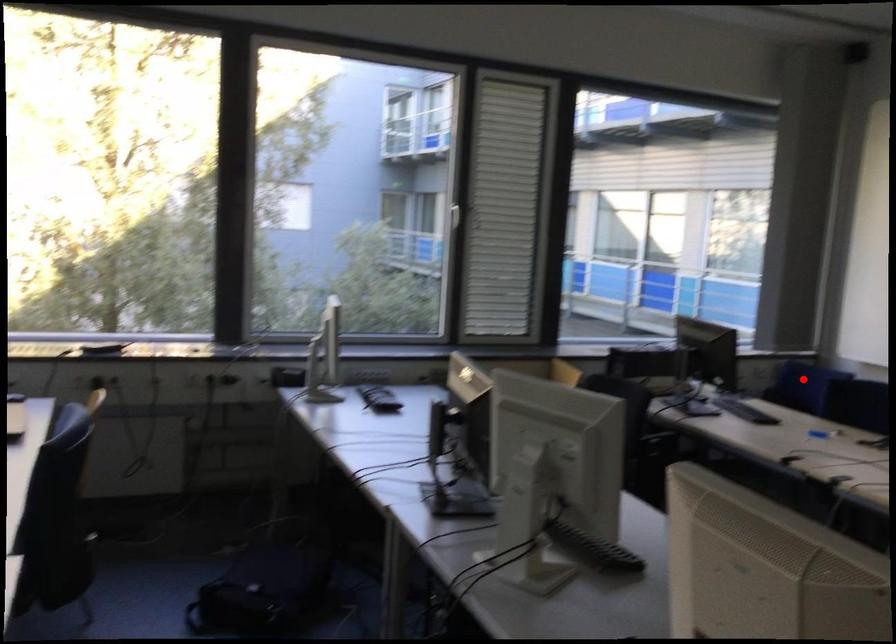
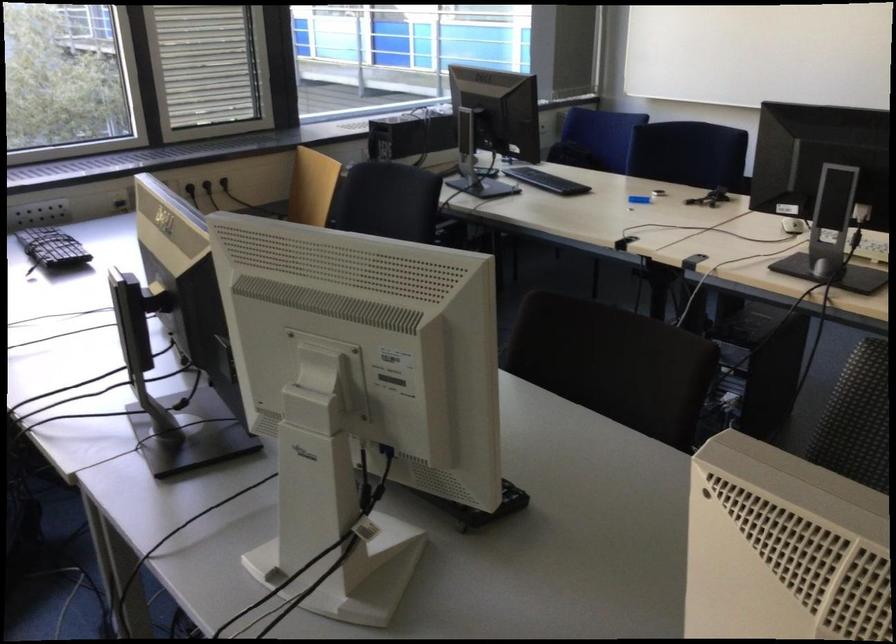
Question: I am providing you with two images of the same scene from different viewpoints. In image1, a red point is highlighted. Considering the same 3D point in image2, which of the following is correct?

Choices:
 (A) It is closer
 (B) It is farther

Answer: (A)